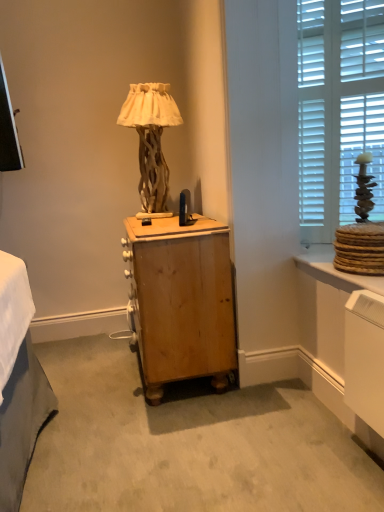
Question: From the image's perspective, does matte wood vanity at lower right appear higher than wooden nightstand at center?

Choices:
 (A) no
 (B) yes

Answer: (A)

Question: Does matte wood vanity at lower right come behind wooden nightstand at center?

Choices:
 (A) no
 (B) yes

Answer: (A)

Question: Does matte wood vanity at lower right have a larger size compared to wooden nightstand at center?

Choices:
 (A) yes
 (B) no

Answer: (B)

Question: Does matte wood vanity at lower right have a lesser width compared to wooden nightstand at center?

Choices:
 (A) yes
 (B) no

Answer: (A)

Question: Is matte wood vanity at lower right looking in the opposite direction of wooden nightstand at center?

Choices:
 (A) yes
 (B) no

Answer: (B)

Question: From a real-world perspective, relative to wooden nightstand at center, is wooden textured lamp at center vertically above or below?

Choices:
 (A) below
 (B) above

Answer: (B)

Question: Choose the correct answer: Is wooden textured lamp at center inside wooden nightstand at center or outside it?

Choices:
 (A) outside
 (B) inside

Answer: (A)

Question: From the image's perspective, relative to wooden nightstand at center, is wooden textured lamp at center above or below?

Choices:
 (A) above
 (B) below

Answer: (A)

Question: Considering the positions of wooden textured lamp at center and wooden nightstand at center in the image, is wooden textured lamp at center bigger or smaller than wooden nightstand at center?

Choices:
 (A) big
 (B) small

Answer: (B)

Question: Considering the positions of white wood blinds at upper right and wooden textured lamp at center in the image, is white wood blinds at upper right taller or shorter than wooden textured lamp at center?

Choices:
 (A) short
 (B) tall

Answer: (B)

Question: From a real-world perspective, is white wood blinds at upper right above or below wooden textured lamp at center?

Choices:
 (A) below
 (B) above

Answer: (B)

Question: From the image's perspective, is white wood blinds at upper right above or below wooden textured lamp at center?

Choices:
 (A) below
 (B) above

Answer: (B)

Question: Is white wood blinds at upper right in front of or behind wooden textured lamp at center in the image?

Choices:
 (A) behind
 (B) front

Answer: (B)

Question: Do you think wooden nightstand at center is within matte wood vanity at lower right, or outside of it?

Choices:
 (A) inside
 (B) outside

Answer: (B)

Question: Is wooden nightstand at center wider or thinner than matte wood vanity at lower right?

Choices:
 (A) wide
 (B) thin

Answer: (A)